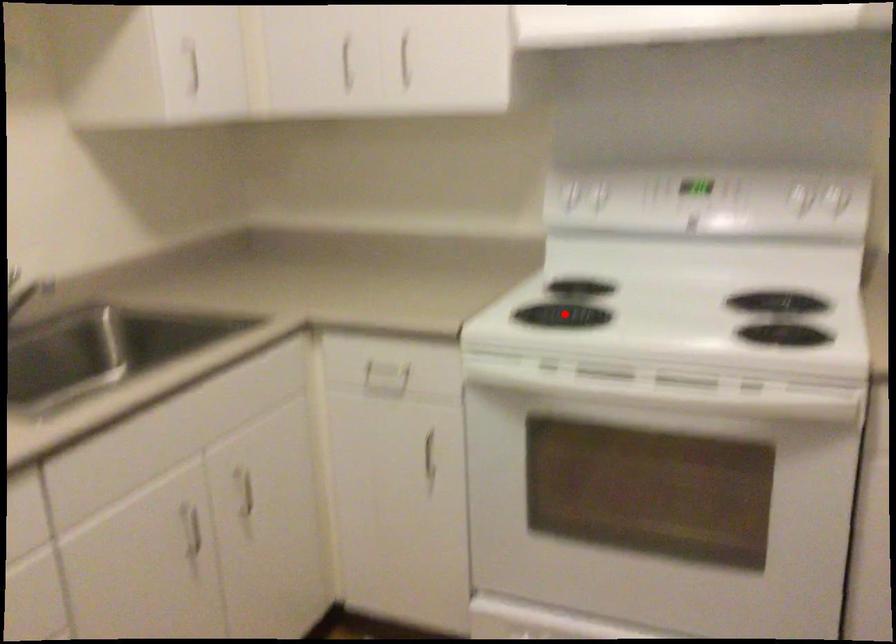
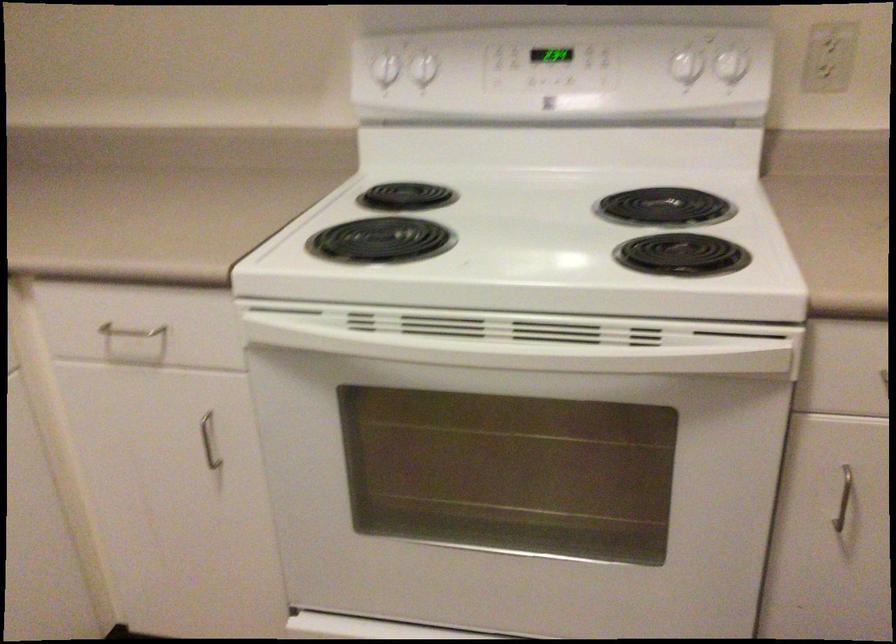
Question: I am providing you with two images of the same scene from different viewpoints. In image1, a red point is highlighted. Considering the same 3D point in image2, which of the following is correct?

Choices:
 (A) It is closer
 (B) It is farther

Answer: (A)